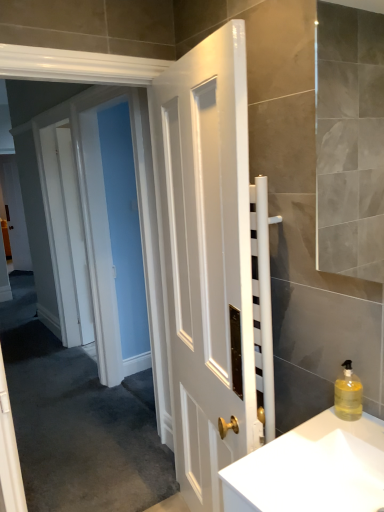
This screenshot has width=384, height=512. I want to click on vacant area on top of white glossy sink at lower right (from a real-world perspective), so click(x=306, y=441).